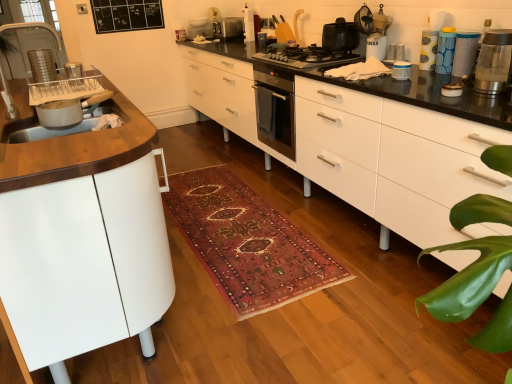
Question: Should I look upward or downward to see black matte pot at center, arranged as the second kitchen appliance when viewed from the right?

Choices:
 (A) down
 (B) up

Answer: (B)

Question: Is black matte pot at center, arranged as the second kitchen appliance when viewed from the right, located within white glossy toaster at upper center, the 6th appliance positioned from the bottom?

Choices:
 (A) no
 (B) yes

Answer: (A)

Question: Does white glossy toaster at upper center, the 1th appliance from the left, have a lesser height compared to black matte pot at center, positioned as the 2th kitchen appliance in bottom-to-top order?

Choices:
 (A) no
 (B) yes

Answer: (A)

Question: From a real-world perspective, is white glossy toaster at upper center, the 6th appliance positioned from the bottom, located beneath black matte pot at center, which is the second kitchen appliance from back to front?

Choices:
 (A) no
 (B) yes

Answer: (A)

Question: Is white glossy toaster at upper center, the 1th appliance from the left, to the left of black matte pot at center, which is the second kitchen appliance from back to front, from the viewer's perspective?

Choices:
 (A) no
 (B) yes

Answer: (B)

Question: Is white glossy toaster at upper center, the 1th appliance viewed from the back, wider than black matte pot at center, arranged as the second kitchen appliance when viewed from the left?

Choices:
 (A) no
 (B) yes

Answer: (A)

Question: Could you tell me if white glossy toaster at upper center, the 6th appliance positioned from the bottom, is facing black matte pot at center, which is the second kitchen appliance from back to front?

Choices:
 (A) yes
 (B) no

Answer: (B)

Question: Is yellow paper towel dispenser at upper right, which ranks as the 3th appliance in back-to-front order, smaller than carpeted rug at center?

Choices:
 (A) yes
 (B) no

Answer: (A)

Question: From the image's perspective, does yellow paper towel dispenser at upper right, marked as the third appliance in a top-to-bottom arrangement, appear higher than carpeted rug at center?

Choices:
 (A) no
 (B) yes

Answer: (B)

Question: Are yellow paper towel dispenser at upper right, which is the 4th appliance from front to back, and carpeted rug at center located far from each other?

Choices:
 (A) yes
 (B) no

Answer: (A)

Question: From a real-world perspective, is yellow paper towel dispenser at upper right, which ranks as the 3th appliance in back-to-front order, positioned under carpeted rug at center based on gravity?

Choices:
 (A) yes
 (B) no

Answer: (B)

Question: Is yellow paper towel dispenser at upper right, marked as the third appliance in a top-to-bottom arrangement, closer to the viewer compared to carpeted rug at center?

Choices:
 (A) no
 (B) yes

Answer: (A)

Question: Is yellow paper towel dispenser at upper right, the 4th appliance when ordered from left to right, looking in the opposite direction of carpeted rug at center?

Choices:
 (A) yes
 (B) no

Answer: (B)

Question: From a real-world perspective, is white glossy chest of drawers at center under yellow paper towel dispenser at upper right, marked as the third appliance in a top-to-bottom arrangement?

Choices:
 (A) yes
 (B) no

Answer: (A)